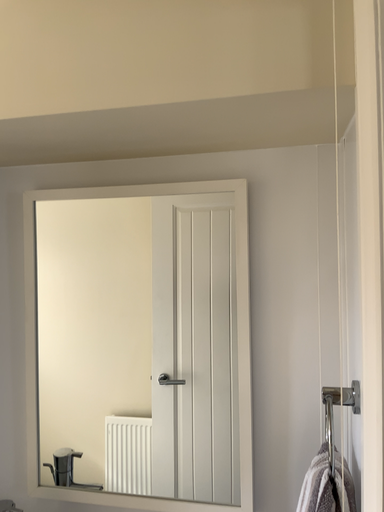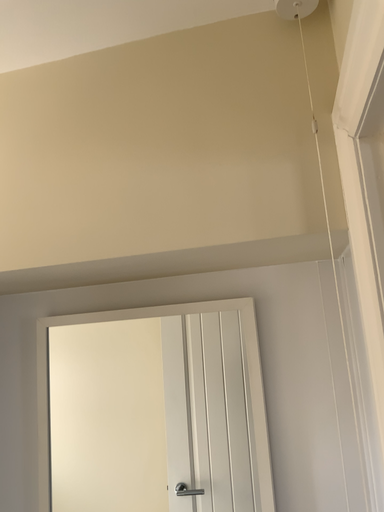
Question: Which way did the camera rotate in the video?

Choices:
 (A) rotated downward
 (B) rotated upward

Answer: (B)